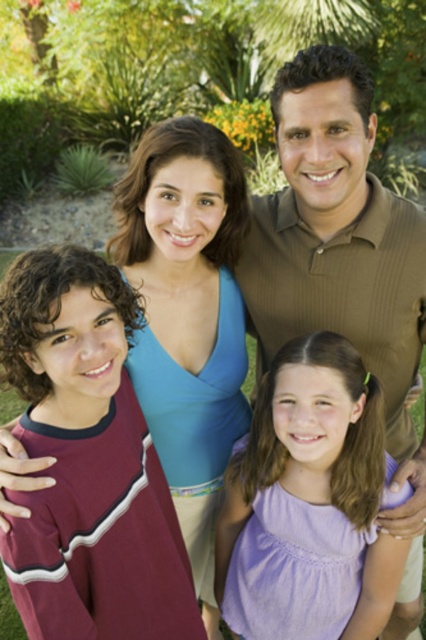
You are a photographer trying to adjust your camera to focus on the brown textured shirt at upper center. According to the coordinates provided, what is the exact 2D location you should aim for?

The exact 2D location for the brown textured shirt at upper center is point (342, 262).

You are standing at point [298,365] and want to walk towards point [307,56]. Which direction should you turn to face point 0.089, 0.700?

Point [307,56] is behind point [298,365], so you should turn around to face point [307,56].